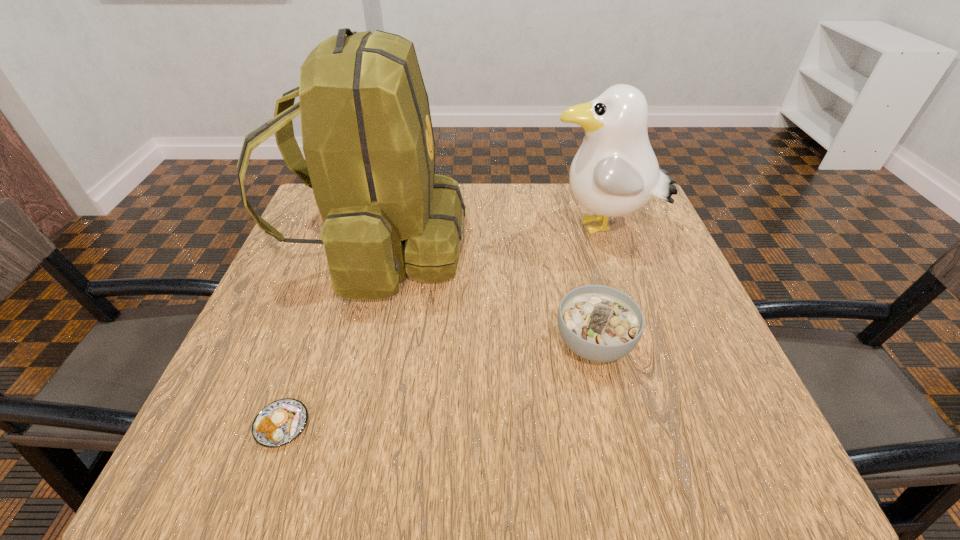
Identify the location of object at the near left corner. (280, 422).

You are a GUI agent. You are given a task and a screenshot of the screen. Output one action in this format:
    pyautogui.click(x=<x>, y=<y>)
    Task: Click on the object present at the far right corner
    
    Given the screenshot: What is the action you would take?
    pyautogui.click(x=615, y=172)

In the image, there is a desktop. Where is `vacant region at the far edge`? vacant region at the far edge is located at coordinates (588, 215).

In the image, there is a desktop. At what (x,y) coordinates should I click in order to perform the action: click on vacant region at the near edge. Please return your answer as a coordinate pair (x, y). Looking at the image, I should click on (631, 429).

I want to click on blank area at the left edge, so click(x=324, y=276).

Image resolution: width=960 pixels, height=540 pixels. I want to click on vacant space at the right edge, so click(x=689, y=289).

In order to click on vacant point located between the second shortest object and the backpack in this screenshot , I will do `click(485, 295)`.

In order to click on free space between the shortest object and the tallest object in this screenshot , I will do `click(329, 336)`.

What are the coordinates of `free space between the backpack and the soup bowl` in the screenshot? It's located at (485, 295).

Where is `free spot between the backpack and the nearest object`? The width and height of the screenshot is (960, 540). free spot between the backpack and the nearest object is located at coordinates (329, 336).